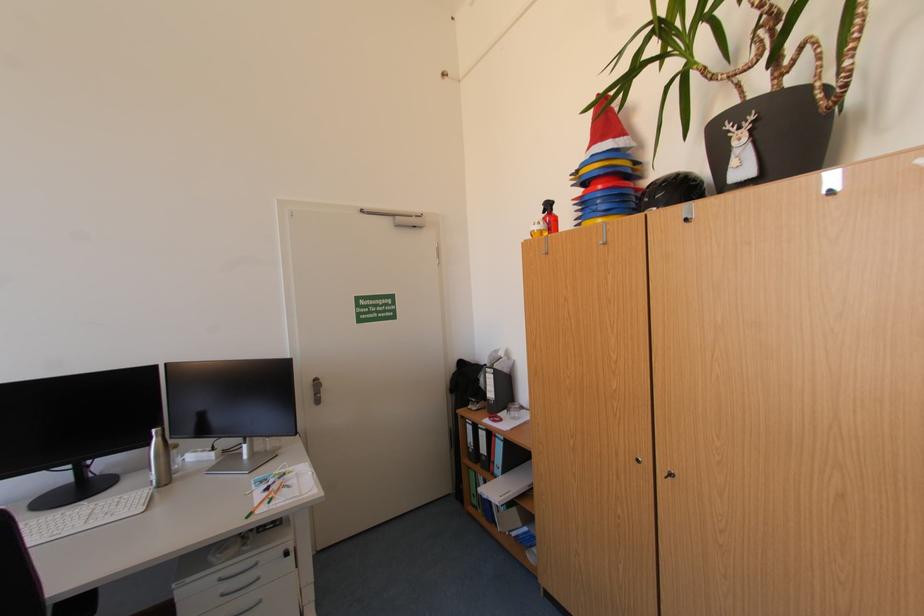
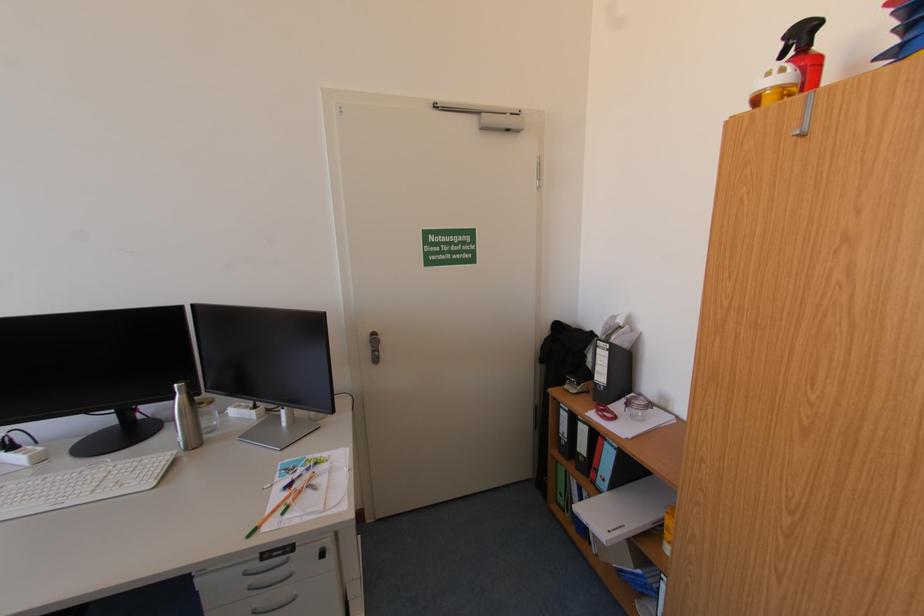
Question: The images are taken continuously from a first-person perspective. In which direction are you moving?

Choices:
 (A) Left
 (B) Right
 (C) Forward
 (D) Backward

Answer: (C)